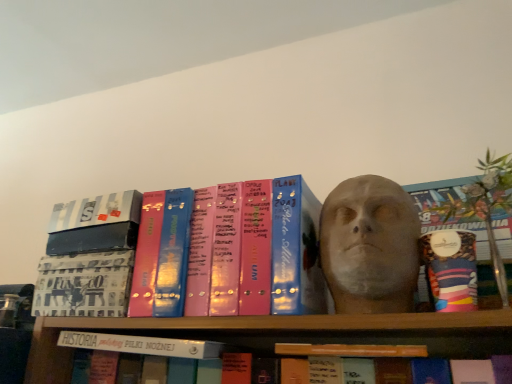
Question: From a real-world perspective, is matte pink binder at center, the 4th book from the left, positioned over white matte book at center, marked as the 3th book in a right-to-left arrangement, based on gravity?

Choices:
 (A) no
 (B) yes

Answer: (B)

Question: Is matte pink binder at center, arranged as the second book when viewed from the right, positioned in front of white matte book at center, the third book viewed from the left?

Choices:
 (A) yes
 (B) no

Answer: (A)

Question: Is matte pink binder at center, the 4th book from the left, taller than white matte book at center, marked as the 3th book in a right-to-left arrangement?

Choices:
 (A) yes
 (B) no

Answer: (A)

Question: Can you confirm if matte pink binder at center, arranged as the second book when viewed from the right, is thinner than white matte book at center, the third book viewed from the left?

Choices:
 (A) yes
 (B) no

Answer: (A)

Question: Is matte pink binder at center, the 4th book from the left, smaller than white matte book at center, the third book viewed from the left?

Choices:
 (A) no
 (B) yes

Answer: (A)

Question: Is white matte book at center, the third book viewed from the left, situated inside matte pink binder at center, arranged as the second book when viewed from the right, or outside?

Choices:
 (A) inside
 (B) outside

Answer: (B)

Question: Based on their sizes in the image, would you say white matte book at center, the third book viewed from the left, is bigger or smaller than matte pink binder at center, the 4th book from the left?

Choices:
 (A) big
 (B) small

Answer: (B)

Question: From a real-world perspective, relative to matte pink binder at center, arranged as the second book when viewed from the right, is white matte book at center, the third book viewed from the left, vertically above or below?

Choices:
 (A) below
 (B) above

Answer: (A)

Question: Is white matte book at center, marked as the 3th book in a right-to-left arrangement, taller or shorter than matte pink binder at center, arranged as the second book when viewed from the right?

Choices:
 (A) short
 (B) tall

Answer: (A)

Question: Relative to matte pink binder at center, the 4th book from the left, is green leafy plant at upper right in front or behind?

Choices:
 (A) front
 (B) behind

Answer: (A)

Question: Would you say green leafy plant at upper right is to the left or to the right of matte pink binder at center, arranged as the second book when viewed from the right, in the picture?

Choices:
 (A) left
 (B) right

Answer: (B)

Question: From the image's perspective, is green leafy plant at upper right positioned above or below matte pink binder at center, the 4th book from the left?

Choices:
 (A) below
 (B) above

Answer: (B)

Question: From a real-world perspective, relative to matte pink binder at center, arranged as the second book when viewed from the right, is green leafy plant at upper right vertically above or below?

Choices:
 (A) below
 (B) above

Answer: (B)

Question: In terms of height, does green leafy plant at upper right look taller or shorter compared to metallic silver book at upper left, which appears as the second book when viewed from the left?

Choices:
 (A) short
 (B) tall

Answer: (B)

Question: Is green leafy plant at upper right inside or outside of metallic silver book at upper left, which appears as the second book when viewed from the left?

Choices:
 (A) inside
 (B) outside

Answer: (B)